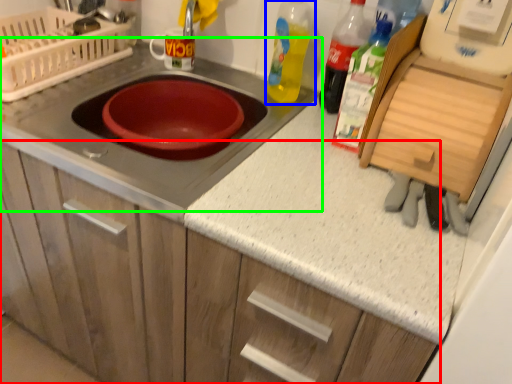
Question: Which is nearer to the cabinetry (highlighted by a red box)? bottle (highlighted by a blue box) or gas stove (highlighted by a green box).

Choices:
 (A) bottle
 (B) gas stove

Answer: (B)